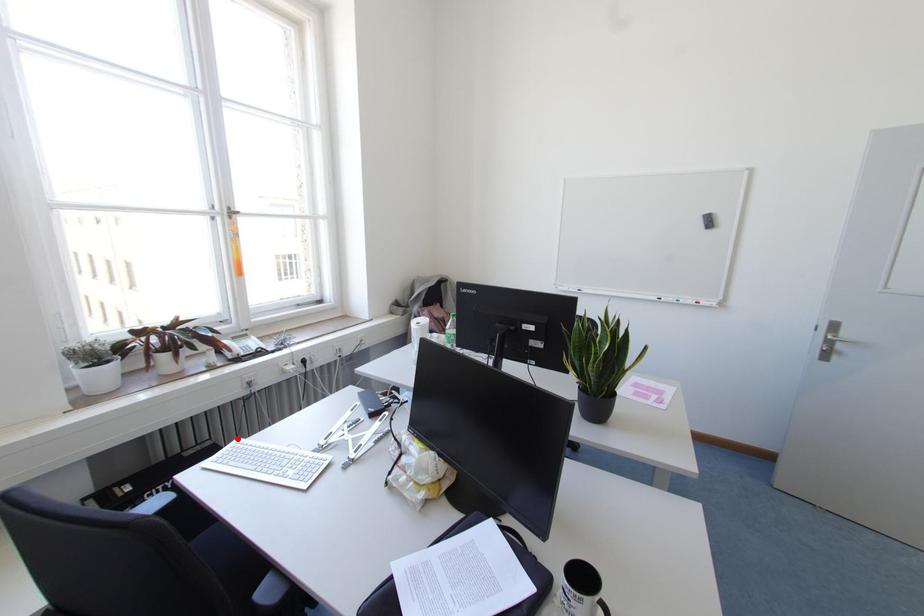
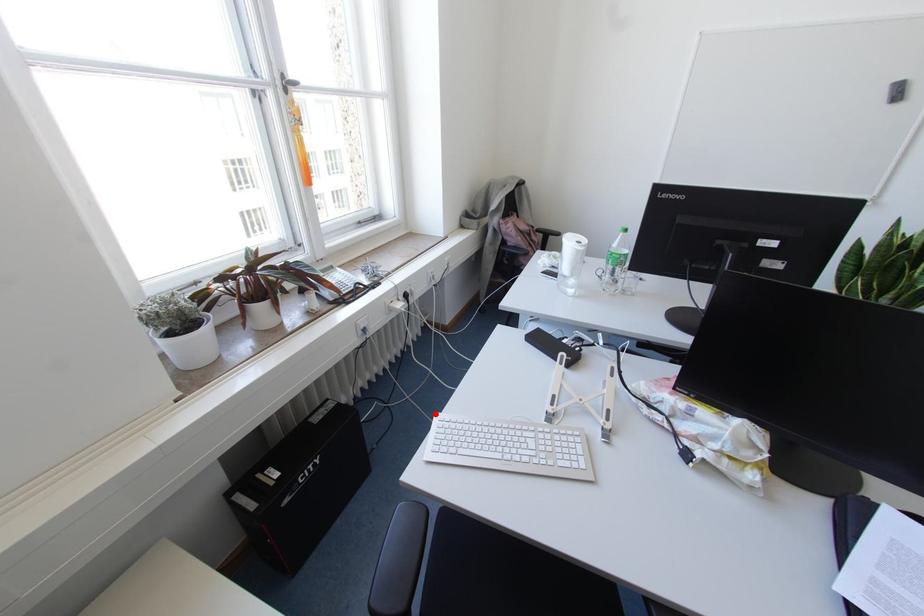
I am providing you with two images of the same scene from different viewpoints. A red point is marked on the first image and another point is marked on the second image. Is the red point in image1 aligned with the point shown in image2?

Yes